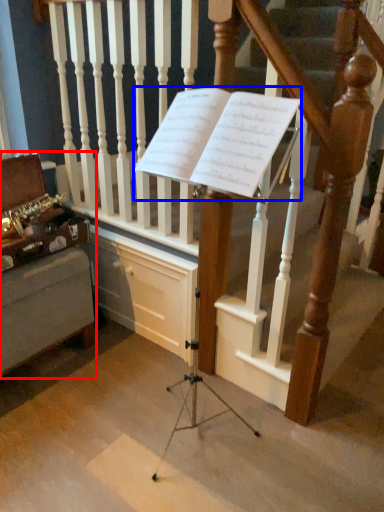
Question: Which of the following is the farthest to the observer, furniture (highlighted by a red box) or sheet music (highlighted by a blue box)?

Choices:
 (A) furniture
 (B) sheet music

Answer: (A)